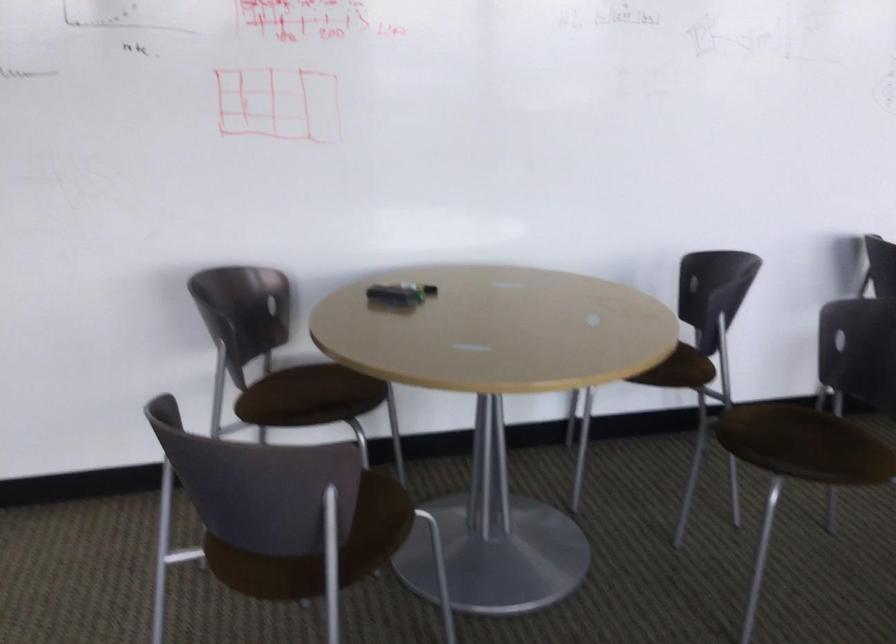
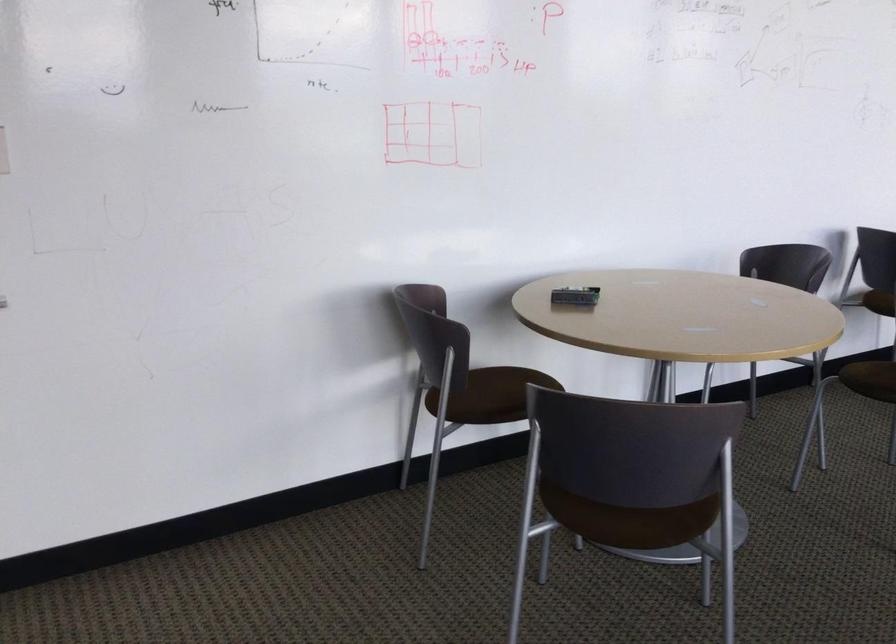
Question: I am providing you with two images of the same scene from different viewpoints. Please identify which objects are invisible in image2.

Choices:
 (A) round drawer knob
 (B) chair sitting surface
 (C) whiteboard eraser
 (D) brown chair sitting surface

Answer: (D)